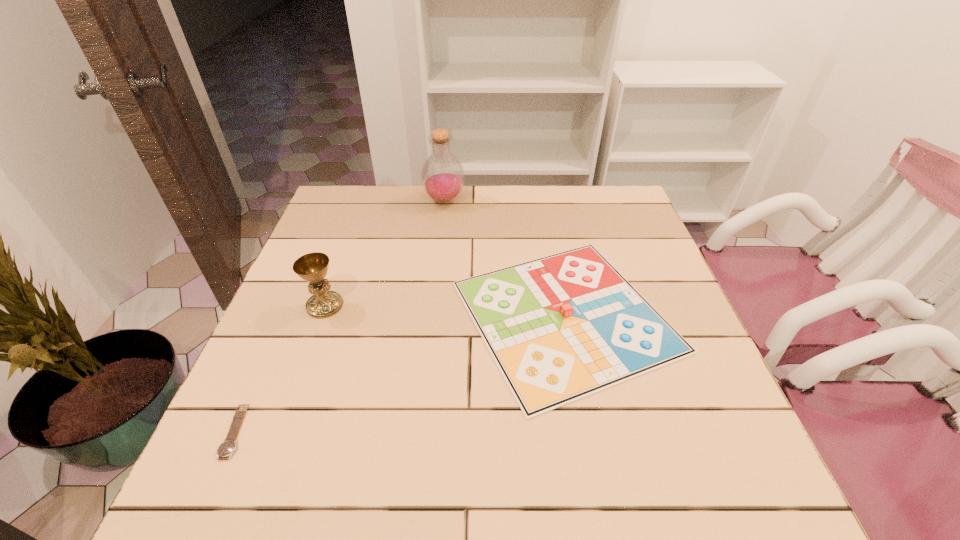
In the image, there is a desktop. Where is `vacant area at the far left corner`? vacant area at the far left corner is located at coordinates (373, 199).

This screenshot has width=960, height=540. In the image, there is a desktop. In order to click on blank space at the far right corner in this screenshot , I will do tap(614, 200).

The height and width of the screenshot is (540, 960). Find the location of `vacant area at the near right corner`. vacant area at the near right corner is located at coordinates (753, 474).

The image size is (960, 540). In order to click on free space between the farthest object and the gameboard in this screenshot , I will do `click(505, 259)`.

Where is `free spot between the shortest object and the second shortest object`? The height and width of the screenshot is (540, 960). free spot between the shortest object and the second shortest object is located at coordinates (400, 374).

Locate an element on the screen. The image size is (960, 540). free point between the gameboard and the bottle is located at coordinates click(x=505, y=259).

You are a GUI agent. You are given a task and a screenshot of the screen. Output one action in this format:
    pyautogui.click(x=<x>, y=<y>)
    Task: Click on the free space between the second shortest object and the second tallest object
    Image resolution: width=960 pixels, height=540 pixels.
    Given the screenshot: What is the action you would take?
    pyautogui.click(x=445, y=311)

I want to click on vacant space that's between the third shortest object and the bottle, so 385,253.

Where is `free space between the gameboard and the farthest object`? The height and width of the screenshot is (540, 960). free space between the gameboard and the farthest object is located at coordinates (505, 259).

The height and width of the screenshot is (540, 960). In order to click on empty space between the tallest object and the second tallest object in this screenshot , I will do `click(385, 253)`.